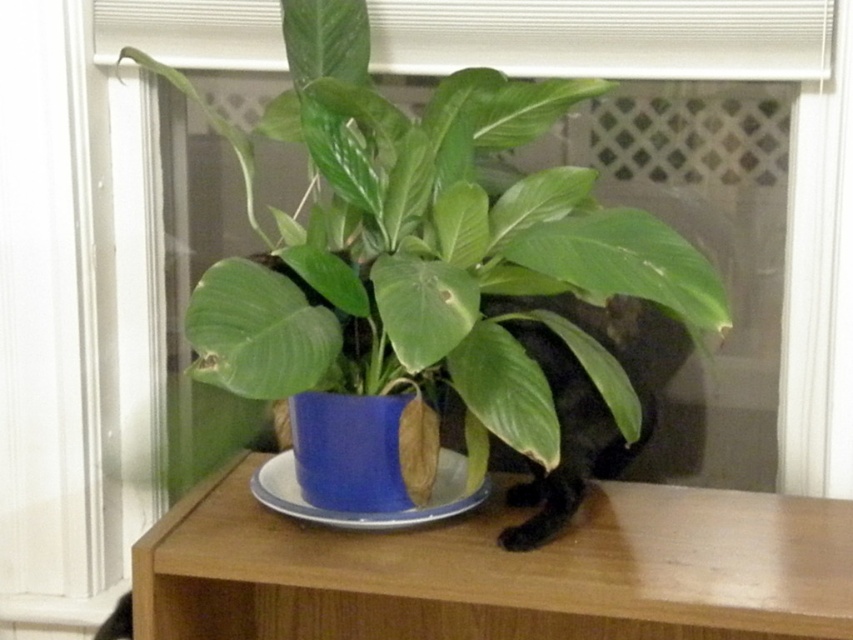
Question: Which point is closer to the camera?

Choices:
 (A) (262, 388)
 (B) (445, 504)
 (C) (639, 614)

Answer: (A)

Question: Is wooden shelf at center in front of blue ceramic plate at center?

Choices:
 (A) no
 (B) yes

Answer: (B)

Question: Which of the following is the closest to the observer?

Choices:
 (A) (442, 470)
 (B) (647, 588)

Answer: (B)

Question: Is blue glossy pot at center to the right of wooden shelf at center from the viewer's perspective?

Choices:
 (A) yes
 (B) no

Answer: (B)

Question: Which point is closer to the camera?

Choices:
 (A) wooden shelf at center
 (B) blue ceramic plate at center

Answer: (A)

Question: Does blue glossy pot at center have a lesser width compared to wooden shelf at center?

Choices:
 (A) no
 (B) yes

Answer: (B)